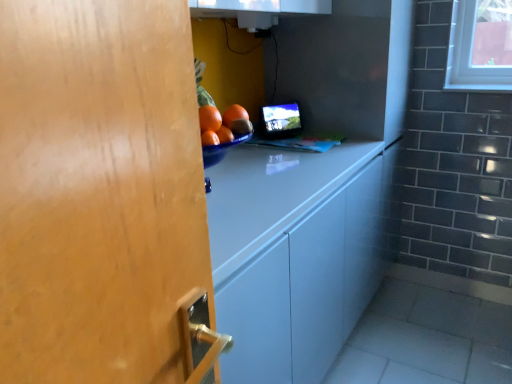
The width and height of the screenshot is (512, 384). In order to click on free location in front of matte black monitor at center in this screenshot , I will do `click(268, 147)`.